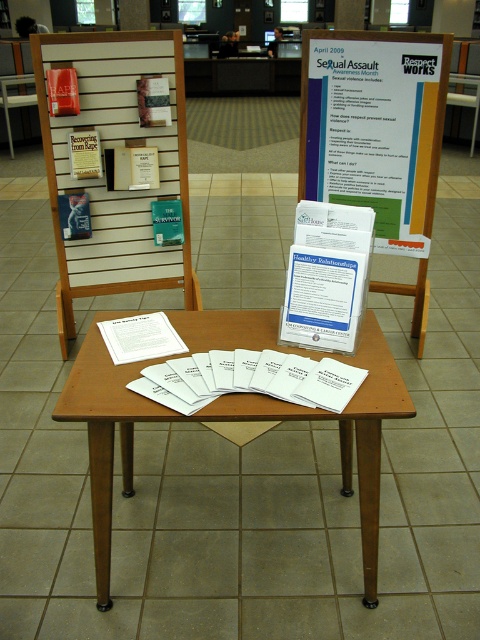
This screenshot has width=480, height=640. Describe the element at coordinates (228, 419) in the screenshot. I see `brown wooden table at center` at that location.

Between brown wooden table at center and wooden chair at left, which one appears on the right side from the viewer's perspective?

brown wooden table at center is more to the right.

Is point (210, 337) positioned in front of point (12, 99)?

Yes, it is in front of point (12, 99).

Image resolution: width=480 pixels, height=640 pixels. I want to click on brown wooden table at center, so click(228, 419).

Is point (123, 76) in front of point (10, 134)?

Yes, point (123, 76) is closer to viewer.

Who is positioned more to the left, white slatted wood at left or wooden chair at left?

wooden chair at left

Which is in front, point (116, 88) or point (11, 83)?

Point (116, 88)

At what (x,y) coordinates should I click in order to perform the action: click on white slatted wood at left. Please return your answer as a coordinate pair (x, y). The image size is (480, 640). Looking at the image, I should click on (104, 176).

Between point (67, 348) and point (350, 461), which one is positioned in front?

Positioned in front is point (350, 461).

Is point (109, 49) positioned in front of point (359, 364)?

That is False.

I want to click on white slatted wood at left, so point(104,176).

Where is `white slatted wood at left`? This screenshot has width=480, height=640. white slatted wood at left is located at coordinates (104, 176).